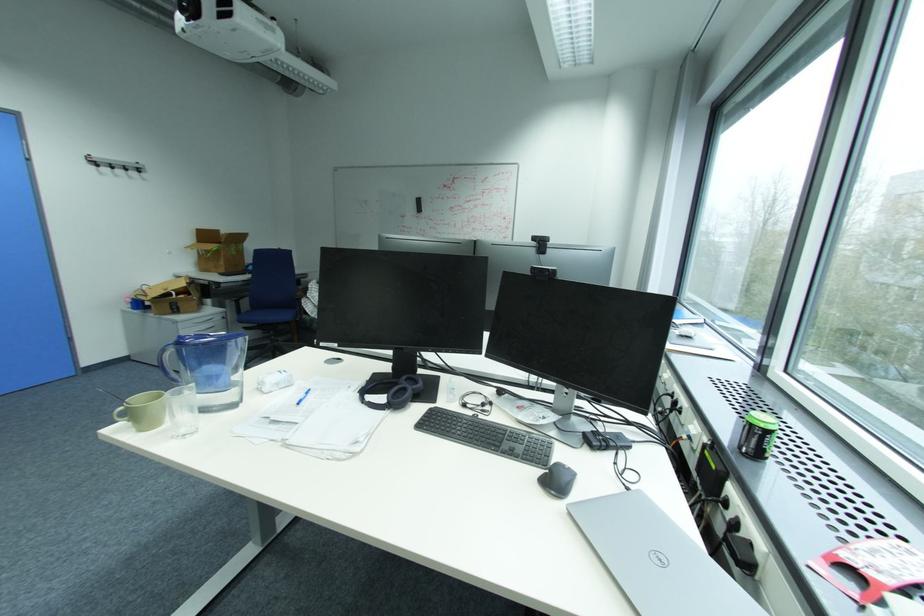
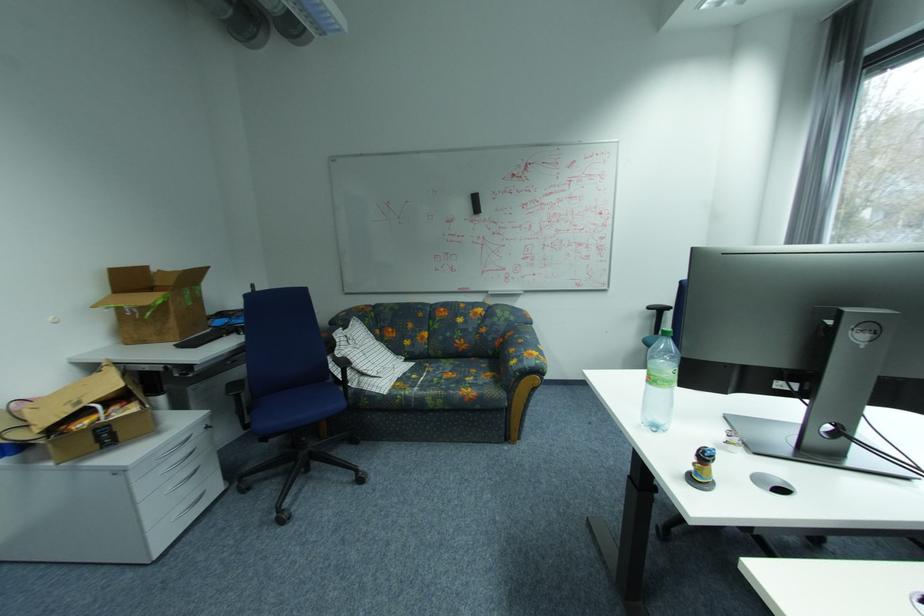
Which direction would the cameraman need to move to produce the second image?

The cameraman walked toward left, forward.